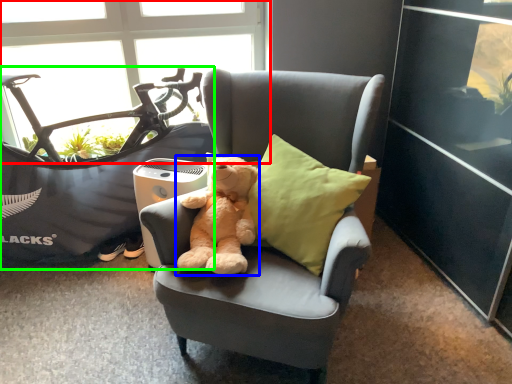
Question: Estimate the real-world distances between objects in this image. Which object is closer to window (highlighted by a red box), teddy bear (highlighted by a blue box) or mountain bike (highlighted by a green box)?

Choices:
 (A) teddy bear
 (B) mountain bike

Answer: (B)